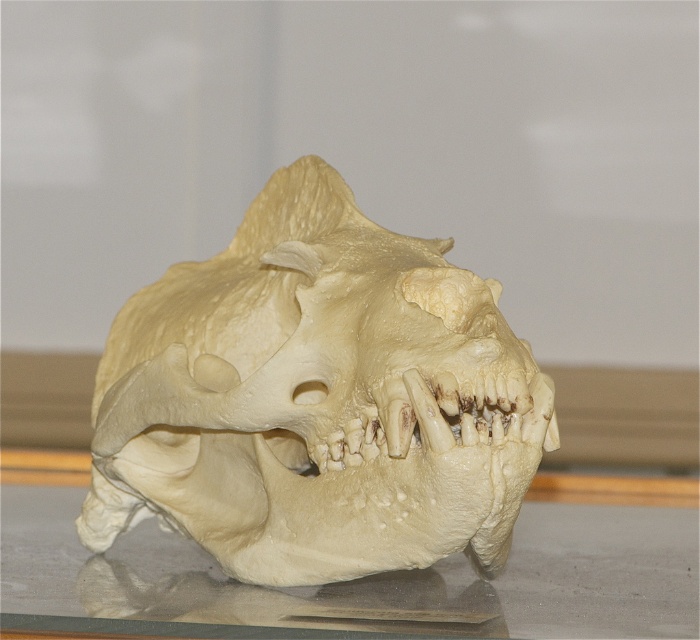
Question: Which object is farther from the camera taking this photo?

Choices:
 (A) white matte skull at center
 (B) translucent glass table at lower center

Answer: (A)

Question: Is white matte skull at center thinner than translucent glass table at lower center?

Choices:
 (A) no
 (B) yes

Answer: (B)

Question: In this image, where is white matte skull at center located relative to translucent glass table at lower center?

Choices:
 (A) left
 (B) right

Answer: (B)

Question: Is white matte skull at center smaller than translucent glass table at lower center?

Choices:
 (A) yes
 (B) no

Answer: (B)